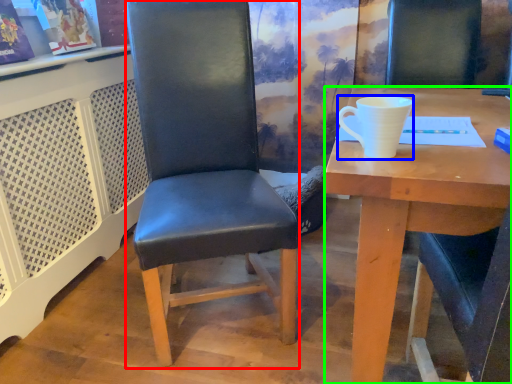
Question: Based on their relative distances, which object is farther from chair (highlighted by a red box)? Choose from coffee cup (highlighted by a blue box) and desk (highlighted by a green box).

Choices:
 (A) coffee cup
 (B) desk

Answer: (A)